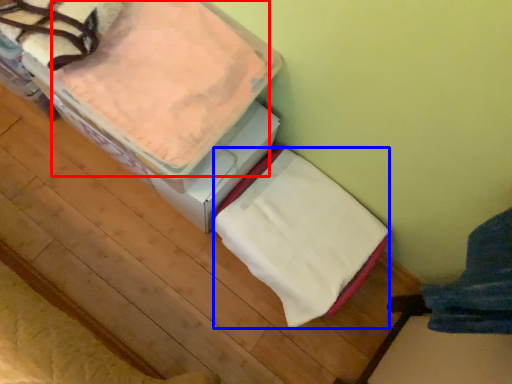
Question: Which of the following is the farthest to the observer, sheet (highlighted by a red box) or blanket (highlighted by a blue box)?

Choices:
 (A) sheet
 (B) blanket

Answer: (B)